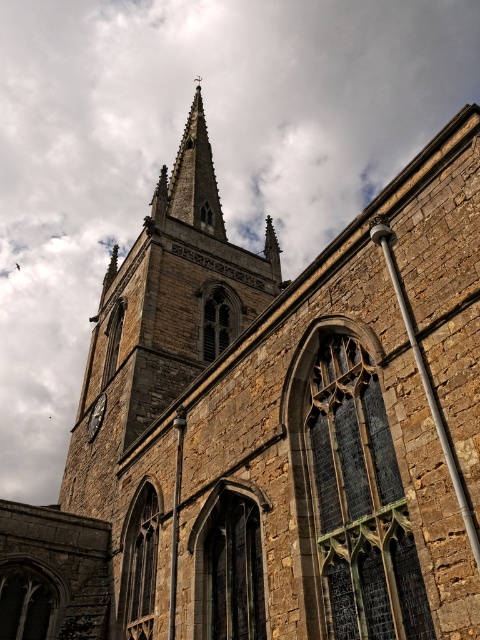
Who is shorter, stone steeple at center or smooth stone spire at center?

Standing shorter between the two is smooth stone spire at center.

Which is below, stone steeple at center or smooth stone spire at center?

stone steeple at center

Image resolution: width=480 pixels, height=640 pixels. Describe the element at coordinates (164, 316) in the screenshot. I see `stone steeple at center` at that location.

Where is `stone steeple at center`? The height and width of the screenshot is (640, 480). stone steeple at center is located at coordinates (164, 316).

From the picture: Is smooth stone spire at center positioned before matte gray clock at lower left?

That is False.

Who is shorter, smooth stone spire at center or matte gray clock at lower left?

matte gray clock at lower left is shorter.

The image size is (480, 640). What do you see at coordinates (195, 177) in the screenshot?
I see `smooth stone spire at center` at bounding box center [195, 177].

Identify the location of smooth stone spire at center. (195, 177).

Which is behind, point (109, 410) or point (101, 392)?

The point (101, 392) is behind.

Can you confirm if stone steeple at center is bigger than matte gray clock at lower left?

Correct, stone steeple at center is larger in size than matte gray clock at lower left.

Between point (82, 477) and point (87, 440), which one is positioned in front?

Point (82, 477) is more forward.

You are a GUI agent. You are given a task and a screenshot of the screen. Output one action in this format:
    pyautogui.click(x=<x>, y=<y>)
    Task: Click on the stone steeple at center
    
    Given the screenshot: What is the action you would take?
    pyautogui.click(x=164, y=316)